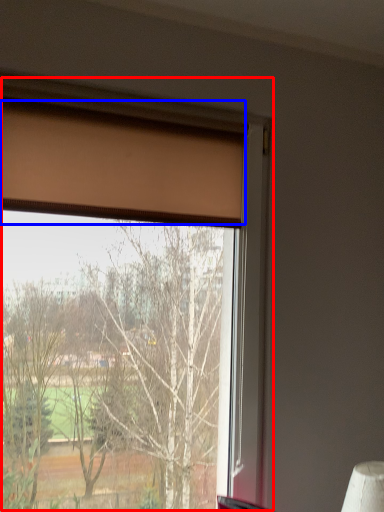
Question: Which object is closer to the camera taking this photo, window (highlighted by a red box) or curtain (highlighted by a blue box)?

Choices:
 (A) window
 (B) curtain

Answer: (A)